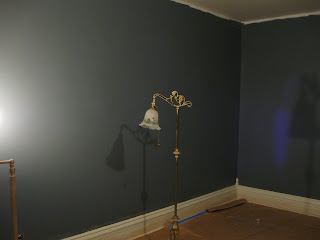
Where is `light`? This screenshot has height=240, width=320. light is located at coordinates coord(1,119).